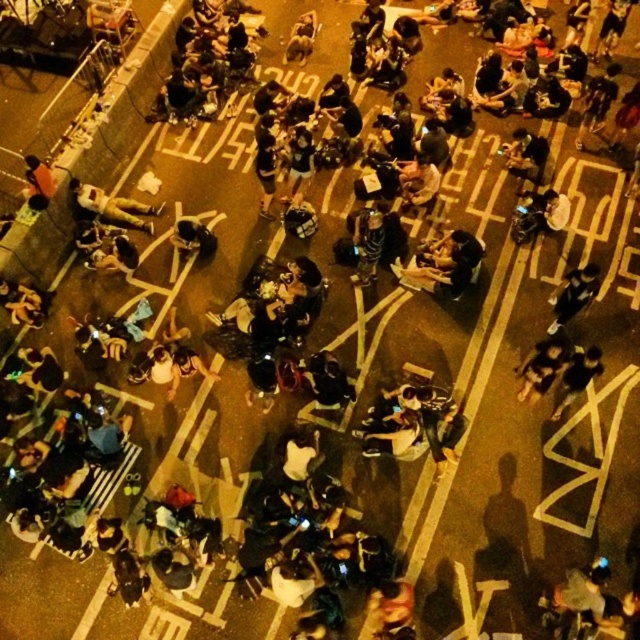
Measure the distance between point (124, 218) and camera.

Point (124, 218) is 15.55 meters away from camera.

Who is more forward, (88, 188) or (35, 188)?

Point (35, 188)

Does point (90, 188) come in front of point (36, 170)?

No, it is behind (36, 170).

I want to click on dark gray fabric body at lower left, so click(113, 205).